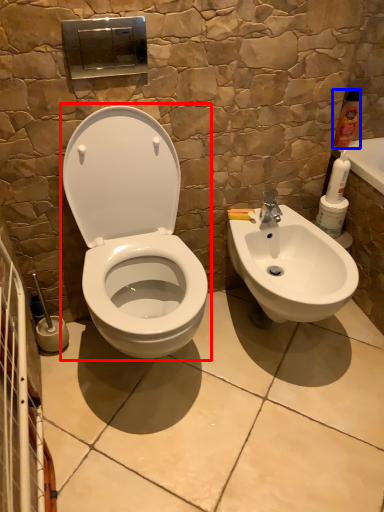
Question: Which object appears closest to the camera in this image, toilet (highlighted by a red box) or cleaning product (highlighted by a blue box)?

Choices:
 (A) toilet
 (B) cleaning product

Answer: (A)